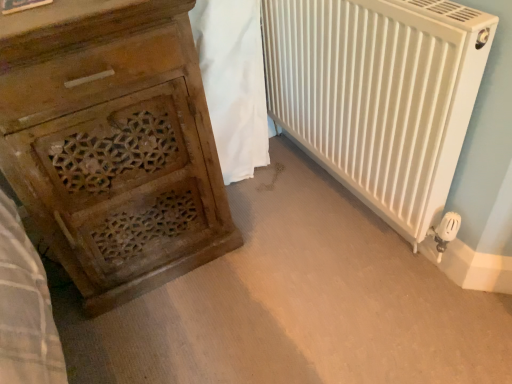
Find the location of a particular element. wooden carved chest of drawers at left is located at coordinates (113, 143).

The height and width of the screenshot is (384, 512). I want to click on white fabric at center, so click(x=233, y=82).

Identify the location of wooden carved chest of drawers at left. The height and width of the screenshot is (384, 512). (113, 143).

You are a GUI agent. You are given a task and a screenshot of the screen. Output one action in this format:
    pyautogui.click(x=<x>, y=<y>)
    Task: Click on the radiator below the white fabric at center (from the image's perspective)
    The image size is (512, 384).
    Given the screenshot: What is the action you would take?
    pyautogui.click(x=379, y=93)

Is white matte radiator at right completely or partially outside of white fabric at center?

Yes.

How different are the orientations of white matte radiator at right and white fabric at center in degrees?

white matte radiator at right and white fabric at center are facing 90 degrees away from each other.

Based on the photo, from the image's perspective, between white matte radiator at right and white fabric at center, who is located below?

white matte radiator at right, from the image's perspective.

Considering the relative sizes of white fabric at center and white matte radiator at right in the image provided, is white fabric at center smaller than white matte radiator at right?

Yes, white fabric at center is smaller than white matte radiator at right.

Is white fabric at center far from white matte radiator at right?

Actually, white fabric at center and white matte radiator at right are a little close together.

From a real-world perspective, between white fabric at center and white matte radiator at right, who is vertically higher?

white matte radiator at right, from a real-world perspective.

Is point (244, 81) closer or farther from the camera than point (354, 44)?

Clearly, point (244, 81) is more distant from the camera than point (354, 44).

Which of these two, white matte radiator at right or wooden carved chest of drawers at left, is smaller?

white matte radiator at right is smaller.

From the image's perspective, which one is positioned lower, white matte radiator at right or wooden carved chest of drawers at left?

wooden carved chest of drawers at left.

Where is `chest of drawers on the left of white matte radiator at right`? chest of drawers on the left of white matte radiator at right is located at coordinates (113, 143).

In the scene shown: Considering the sizes of white matte radiator at right and wooden carved chest of drawers at left in the image, is white matte radiator at right taller or shorter than wooden carved chest of drawers at left?

white matte radiator at right is shorter than wooden carved chest of drawers at left.

Is white matte radiator at right located within wooden carved chest of drawers at left?

No, wooden carved chest of drawers at left does not contain white matte radiator at right.

Considering the positions of points (102, 149) and (365, 167), is point (102, 149) farther from camera compared to point (365, 167)?

That is False.

Is wooden carved chest of drawers at left facing towards white matte radiator at right?

No, wooden carved chest of drawers at left is not facing towards white matte radiator at right.

In the scene shown: Considering the positions of objects wooden carved chest of drawers at left and white fabric at center in the image provided, who is more to the left, wooden carved chest of drawers at left or white fabric at center?

wooden carved chest of drawers at left is more to the left.

Is point (137, 138) positioned behind point (203, 14)?

No, it is not.

From the image's perspective, is wooden carved chest of drawers at left above white fabric at center?

No, from the image's perspective, wooden carved chest of drawers at left is not on top of white fabric at center.

Is point (227, 29) farther from viewer compared to point (193, 148)?

Yes, it is.

Considering the relative sizes of white fabric at center and wooden carved chest of drawers at left in the image provided, is white fabric at center smaller than wooden carved chest of drawers at left?

Yes, white fabric at center is smaller than wooden carved chest of drawers at left.

From the image's perspective, is white fabric at center located above wooden carved chest of drawers at left?

Yes, from the image's perspective, white fabric at center is above wooden carved chest of drawers at left.

The width and height of the screenshot is (512, 384). I want to click on blanket above the white matte radiator at right (from the image's perspective), so click(x=233, y=82).

At what (x,y) coordinates should I click in order to perform the action: click on radiator in front of the white fabric at center. Please return your answer as a coordinate pair (x, y). Looking at the image, I should click on (379, 93).

Looking at this image, looking at the image, which one is located further to wooden carved chest of drawers at left, white fabric at center or white matte radiator at right?

white matte radiator at right.

Looking at the image, which one is located further to white fabric at center, wooden carved chest of drawers at left or white matte radiator at right?

wooden carved chest of drawers at left lies further to white fabric at center than the other object.

Based on their spatial positions, is wooden carved chest of drawers at left or white fabric at center further from white matte radiator at right?

wooden carved chest of drawers at left is further to white matte radiator at right.

Looking at the image, which one is located further to white fabric at center, white matte radiator at right or wooden carved chest of drawers at left?

Based on the image, wooden carved chest of drawers at left appears to be further to white fabric at center.

Looking at the image, which one is located closer to wooden carved chest of drawers at left, white matte radiator at right or white fabric at center?

Based on the image, white fabric at center appears to be nearer to wooden carved chest of drawers at left.

When comparing their distances from white matte radiator at right, does white fabric at center or wooden carved chest of drawers at left seem closer?

The object closer to white matte radiator at right is white fabric at center.

At what (x,y) coordinates should I click in order to perform the action: click on blanket between wooden carved chest of drawers at left and white matte radiator at right in the horizontal direction. Please return your answer as a coordinate pair (x, y). Looking at the image, I should click on (233, 82).